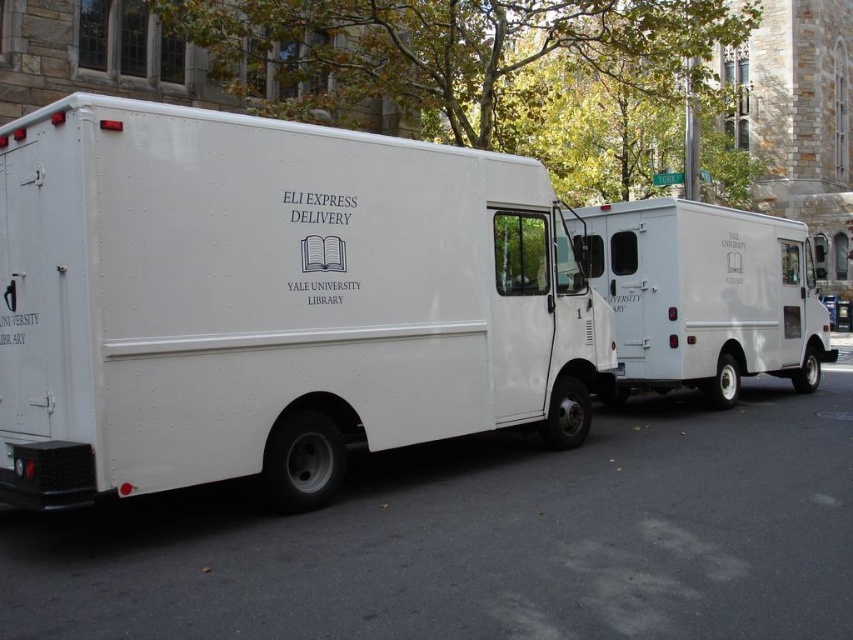
You are a delivery person who needs to load packages onto both the white matte van at center and the white matte van at right. Which van should you approach first if you want to load the lower one first?

The white matte van at center is below the white matte van at right, so you should approach the white matte van at center first to load the lower one first.

You are a delivery person who needs to park a third van between the two existing vans. Given that the white matte van at center and the white matte van at right are parked side by side, which van should you park next to to ensure enough space for your van?

The white matte van at center has a lesser width compared to the white matte van at right, so you should park next to the wider white matte van at right to ensure there is more space available for your van.